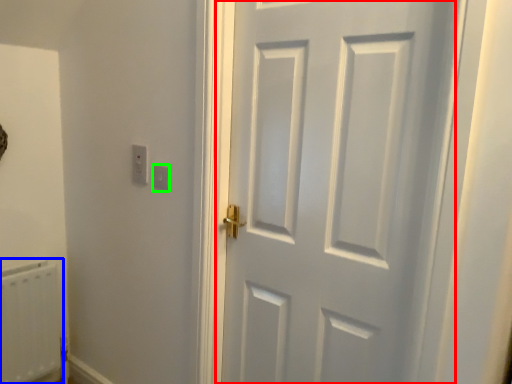
Question: Based on their relative distances, which object is nearer to door (highlighted by a red box)? Choose from radiator (highlighted by a blue box) and light switch (highlighted by a green box).

Choices:
 (A) radiator
 (B) light switch

Answer: (B)